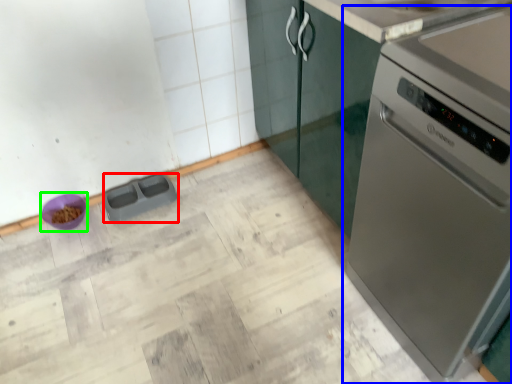
Question: Which is farther away from appliance (highlighted by a red box)? home appliance (highlighted by a blue box) or appliance (highlighted by a green box)?

Choices:
 (A) home appliance
 (B) appliance

Answer: (A)